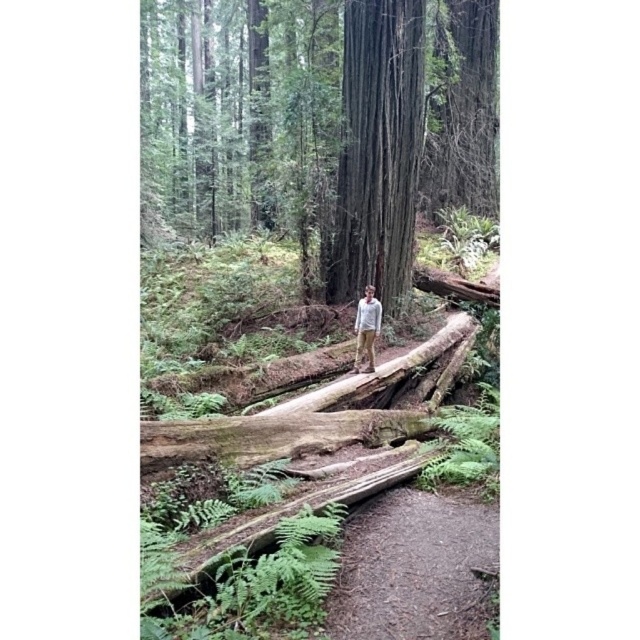
Question: Which point is closer to the camera taking this photo?

Choices:
 (A) (368, 349)
 (B) (413, 104)
 (C) (381, 161)
 (D) (326, 612)

Answer: (D)

Question: Which is nearer to the light gray sweater at center?

Choices:
 (A) smooth dark brown tree trunk at center
 (B) brown dirt path at lower center

Answer: (A)

Question: Is smooth brown trunk at center bigger than light gray sweater at center?

Choices:
 (A) no
 (B) yes

Answer: (B)

Question: Which object is farther from the camera taking this photo?

Choices:
 (A) brown dirt path at lower center
 (B) smooth dark brown tree trunk at center
 (C) light gray sweater at center
 (D) smooth brown trunk at center

Answer: (D)

Question: Where is smooth brown trunk at center located in relation to brown dirt path at lower center in the image?

Choices:
 (A) above
 (B) below

Answer: (A)

Question: Can you confirm if smooth brown trunk at center is positioned above brown dirt path at lower center?

Choices:
 (A) yes
 (B) no

Answer: (A)